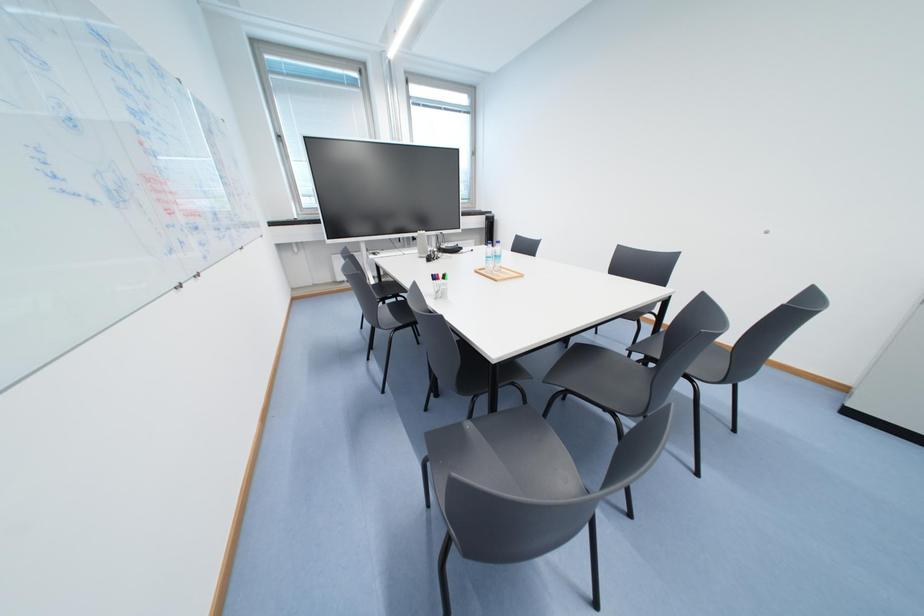
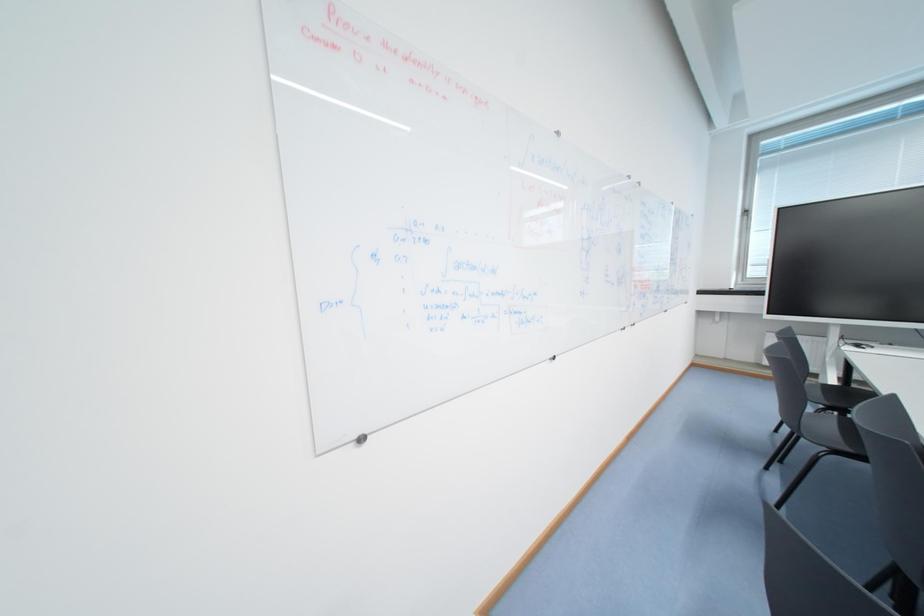
Question: The camera is either moving clockwise (left) or counter-clockwise (right) around the object. The first image is from the beginning of the video and the second image is from the end. Is the camera moving left or right when shooting the video?

Choices:
 (A) Left
 (B) Right

Answer: (B)